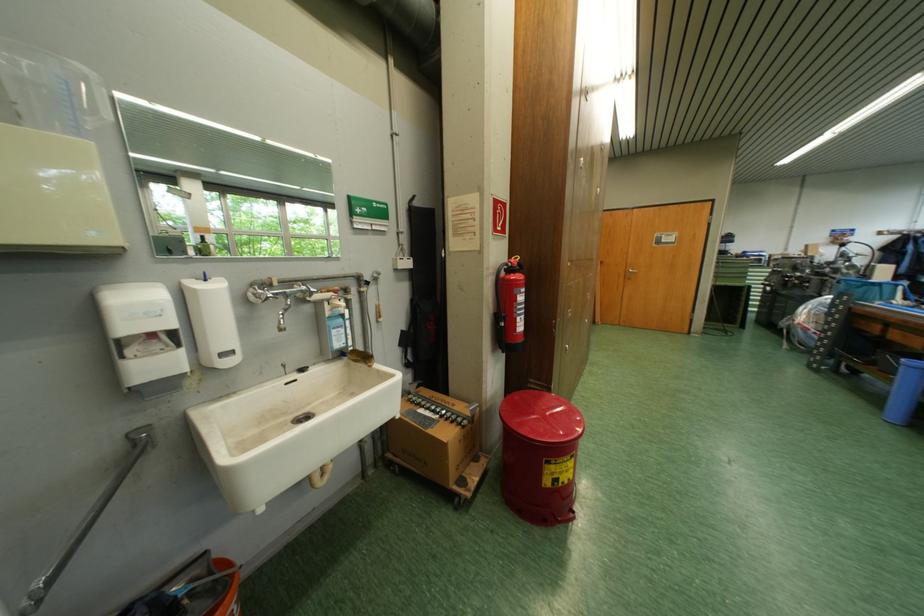
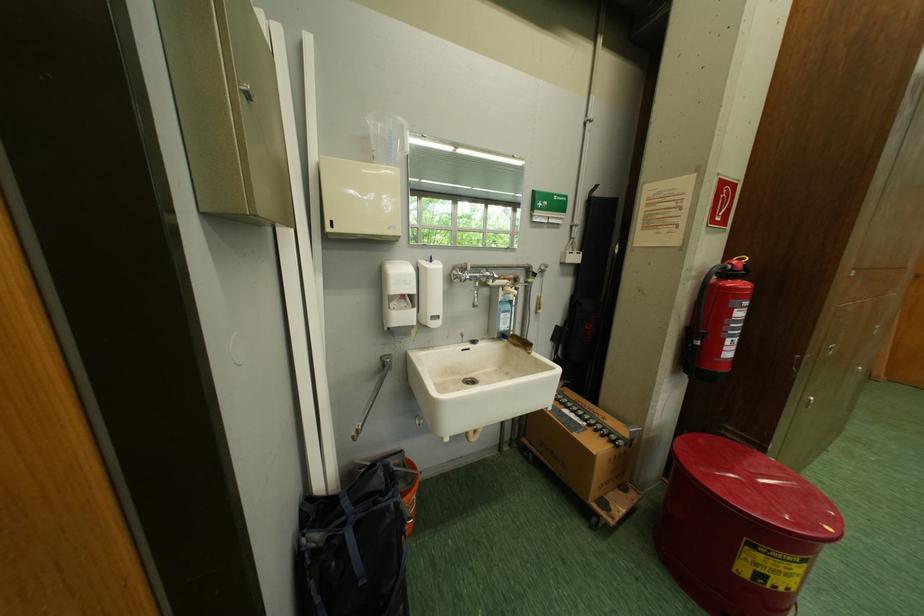
Find the pixel in the second image that matches point (527, 400) in the first image.

(711, 443)